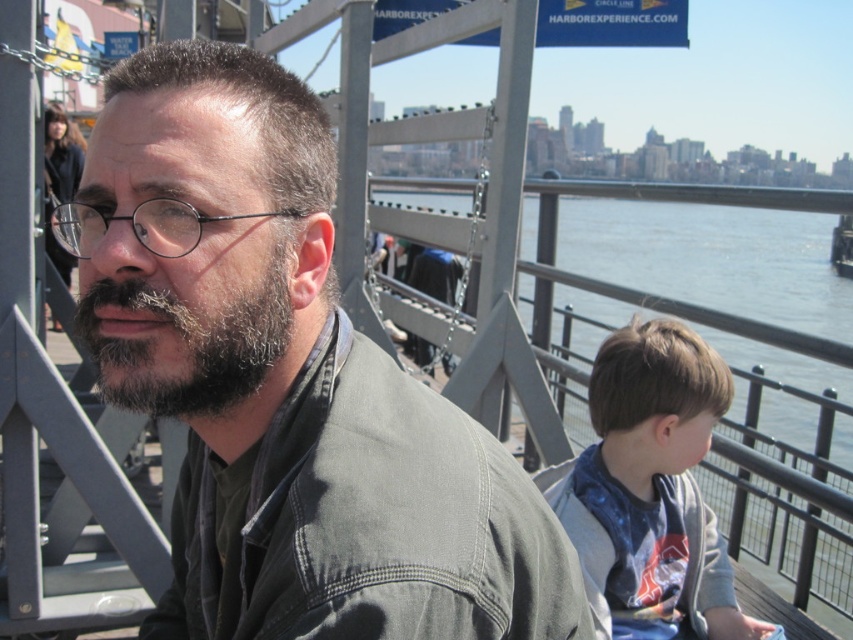
Does blue water at center have a smaller size compared to light brown hair at right?

Incorrect, blue water at center is not smaller in size than light brown hair at right.

Which of these two, blue water at center or light brown hair at right, stands taller?

blue water at center is taller.

Between point (769, 499) and point (614, 448), which one is positioned behind?

The point (769, 499) is more distant.

Find the location of `blue water at center`. blue water at center is located at coordinates (724, 353).

Which of these two, blue water at center or dark brown fuzzy beard at center, stands taller?

With more height is blue water at center.

Find the location of a particular element. The width and height of the screenshot is (853, 640). blue water at center is located at coordinates (724, 353).

The width and height of the screenshot is (853, 640). Describe the element at coordinates (286, 381) in the screenshot. I see `matte gray jacket at center` at that location.

Where is `matte gray jacket at center`? matte gray jacket at center is located at coordinates (286, 381).